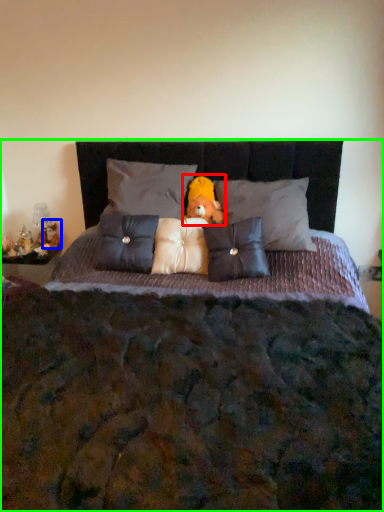
Question: Which object is the farthest from doll (highlighted by a red box)? Choose among these: figurine (highlighted by a blue box) or bed (highlighted by a green box).

Choices:
 (A) figurine
 (B) bed

Answer: (A)